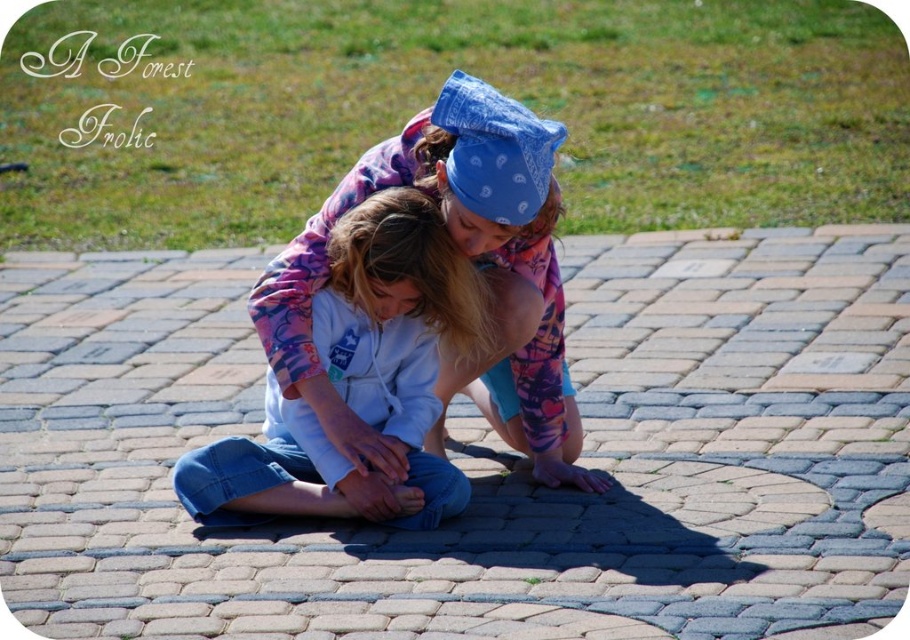
Does floral fleece jacket at center appear over blue denim jeans at center?

Yes, floral fleece jacket at center is above blue denim jeans at center.

What do you see at coordinates (470, 259) in the screenshot? I see `floral fleece jacket at center` at bounding box center [470, 259].

Identify the location of floral fleece jacket at center. (470, 259).

Measure the distance between brick pavement at center and camera.

brick pavement at center and camera are 7.99 meters apart from each other.

Is brick pavement at center to the left of floral fleece jacket at center from the viewer's perspective?

In fact, brick pavement at center is to the right of floral fleece jacket at center.

Where is `brick pavement at center`? The height and width of the screenshot is (640, 910). brick pavement at center is located at coordinates (482, 456).

Is brick pavement at center to the left of blue denim jeans at center from the viewer's perspective?

Incorrect, brick pavement at center is not on the left side of blue denim jeans at center.

Which is below, brick pavement at center or blue denim jeans at center?

brick pavement at center is lower down.

Image resolution: width=910 pixels, height=640 pixels. In order to click on brick pavement at center in this screenshot , I will do `click(482, 456)`.